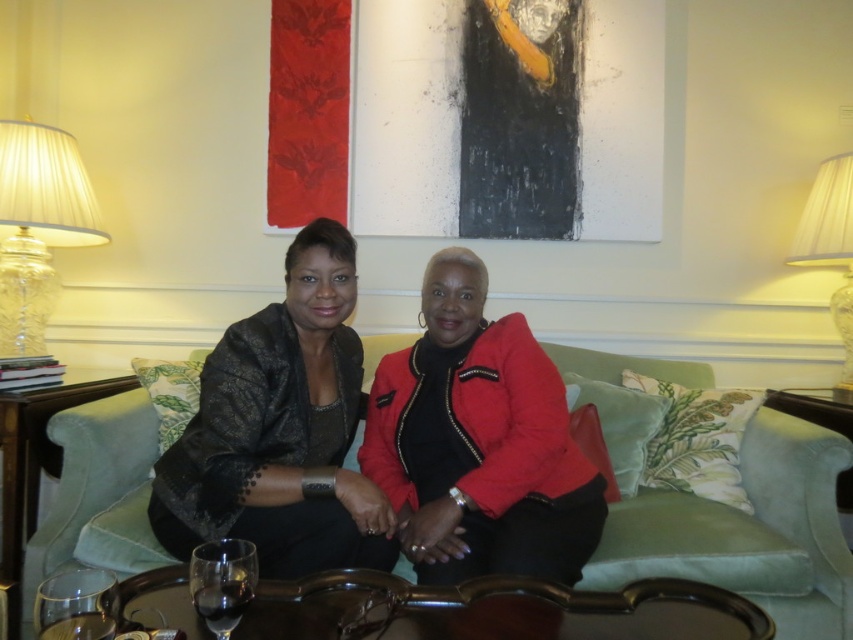
Question: Which point is farther to the camera?

Choices:
 (A) matte red jacket at center
 (B) transparent glass at lower left
 (C) green velvet couch at center

Answer: (C)

Question: Which of the following is the closest to the observer?

Choices:
 (A) wooden table at lower left
 (B) matte red jacket at center
 (C) white fabric lampshade at right

Answer: (A)

Question: Is brown polished wood table at lower center to the left of wooden table at lower left from the viewer's perspective?

Choices:
 (A) no
 (B) yes

Answer: (A)

Question: Where is wooden table at lower left located in relation to transparent glass at center in the image?

Choices:
 (A) below
 (B) above

Answer: (A)

Question: Estimate the real-world distances between objects in this image. Which object is farther from the white fabric lampshade at right?

Choices:
 (A) brown polished wood table at lower center
 (B) metallic black jacket at center

Answer: (A)

Question: Can you confirm if matte red jacket at center is smaller than brown polished wood table at lower center?

Choices:
 (A) no
 (B) yes

Answer: (A)